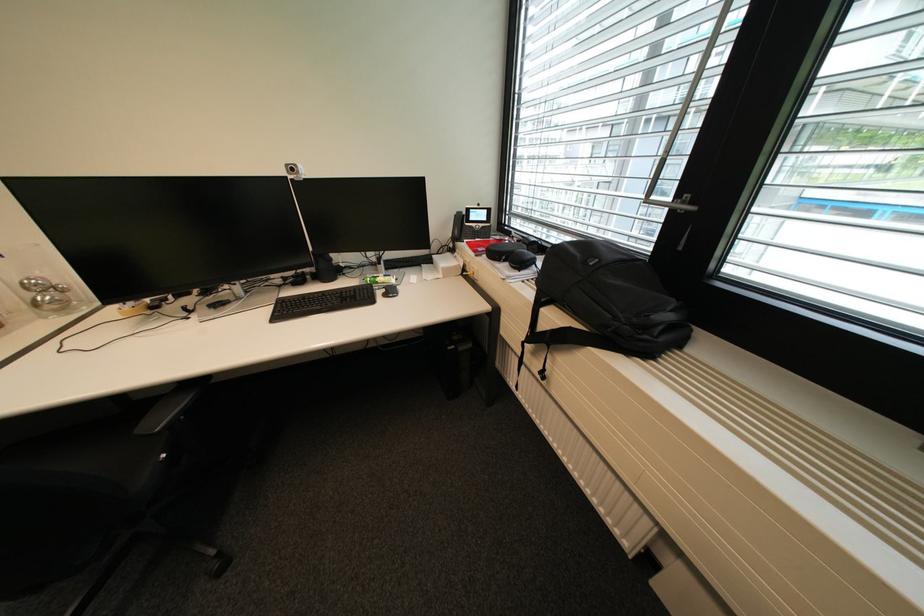
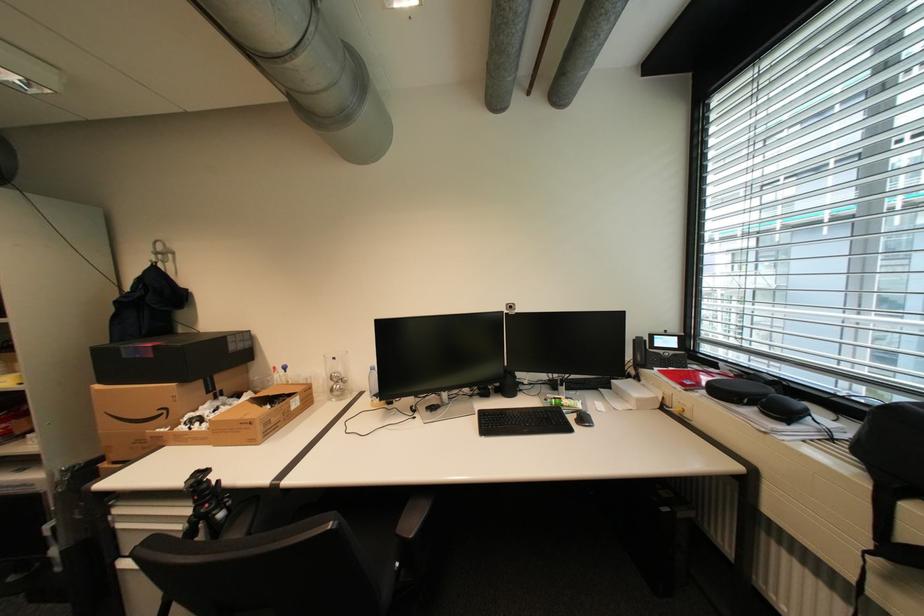
In the second image, find the point that corresponds to [387,293] in the first image.

(579, 419)